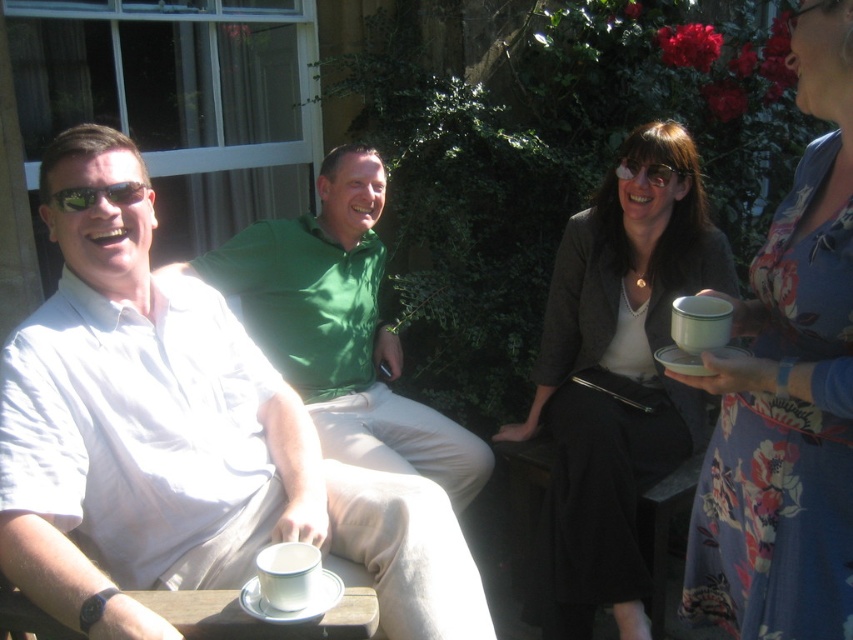
Consider the image. You are organizing a clothing display and need to arrange the floral dress at upper right and the green shiny shirt at center based on their widths. Which should be placed first if you want to arrange them from narrowest to widest?

The floral dress at upper right should be placed first because its width is less than the green shiny shirt at center.

You are standing in the same location as the person holding the teacup and saucer. You want to throw a small ball to a friend located at point (x=73, y=189) and then to another friend at point (x=428, y=412). Which friend should you throw the ball to first to ensure it reaches them without hitting any obstacles?

You should throw the ball to the friend at point (x=73, y=189) first because they are closer to you than the friend at point (x=428, y=412), which is further away.